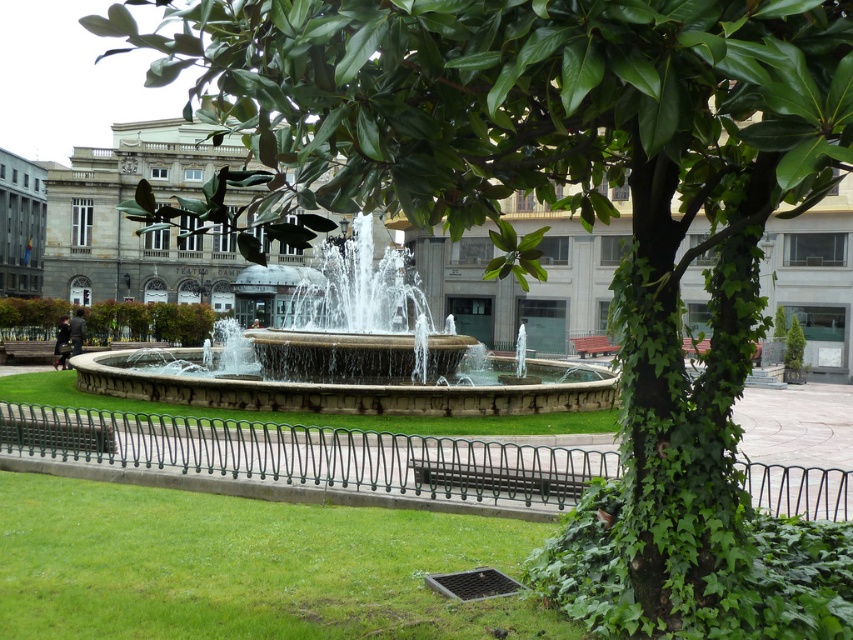
Which is more to the right, green grass at lower left or stone fountain at center?

Positioned to the right is green grass at lower left.

Is point (297, 520) more distant than point (364, 388)?

No, it is not.

You are a GUI agent. You are given a task and a screenshot of the screen. Output one action in this format:
    pyautogui.click(x=<x>, y=<y>)
    Task: Click on the green grass at lower left
    
    Given the screenshot: What is the action you would take?
    [247, 566]

I want to click on green grass at lower left, so click(x=247, y=566).

What do you see at coordinates (355, 356) in the screenshot?
I see `stone fountain at center` at bounding box center [355, 356].

Is stone fountain at center positioned at the back of wooden bench at center?

No, it is in front of wooden bench at center.

You are a GUI agent. You are given a task and a screenshot of the screen. Output one action in this format:
    pyautogui.click(x=<x>, y=<y>)
    Task: Click on the stone fountain at center
    The height and width of the screenshot is (640, 853).
    Given the screenshot: What is the action you would take?
    pyautogui.click(x=355, y=356)

Does green grass at lower left appear under wooden bench at center?

Correct, green grass at lower left is located below wooden bench at center.

What do you see at coordinates (247, 566) in the screenshot?
I see `green grass at lower left` at bounding box center [247, 566].

Where is `green grass at lower left`? The width and height of the screenshot is (853, 640). green grass at lower left is located at coordinates [247, 566].